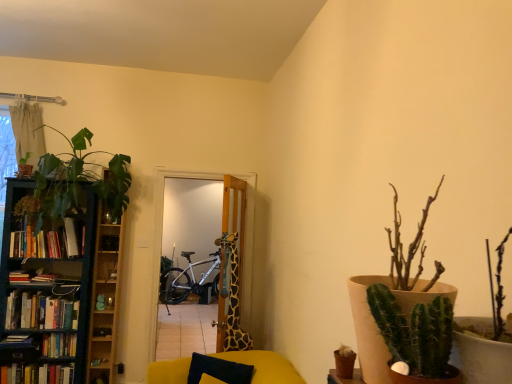
The height and width of the screenshot is (384, 512). Find the location of `green leafy plant at upper left, the third houseplant when ordered from right to left`. green leafy plant at upper left, the third houseplant when ordered from right to left is located at coordinates (24, 167).

What is the approximate height of beige fabric curtain at upper left?

Answer: beige fabric curtain at upper left is 25.78 inches in height.

In order to click on hardcover books at left, which ranks as the 5th book in top-to-bottom order in this screenshot , I will do `click(36, 374)`.

This screenshot has height=384, width=512. I want to click on teal wooden bookcase at left, so click(x=46, y=292).

Is hardcover books at left, marked as the 1th book in a top-to-bottom arrangement, turned away from green leafy plant at left, which ranks as the 2th houseplant in left-to-right order?

That's right, hardcover books at left, marked as the 1th book in a top-to-bottom arrangement, is facing away from green leafy plant at left, which ranks as the 2th houseplant in left-to-right order.

Looking at their sizes, would you say hardcover books at left, arranged as the fifth book when ordered from the bottom, is wider or thinner than green leafy plant at left, the 2th houseplant viewed from the right?

hardcover books at left, arranged as the fifth book when ordered from the bottom, is thinner than green leafy plant at left, the 2th houseplant viewed from the right.

Between point (65, 220) and point (44, 161), which one is positioned in front?

The point (44, 161) is closer.

Is hardcover books at left, arranged as the fifth book when ordered from the bottom, taller or shorter than green leafy plant at left, which ranks as the 2th houseplant in left-to-right order?

In the image, hardcover books at left, arranged as the fifth book when ordered from the bottom, appears to be shorter than green leafy plant at left, which ranks as the 2th houseplant in left-to-right order.

Based on the photo, how many degrees apart are the facing directions of hardcover books at left, marked as the 1th book in a top-to-bottom arrangement, and giraffe-patterned wood screen door at center?

111 degrees separate the facing orientations of hardcover books at left, marked as the 1th book in a top-to-bottom arrangement, and giraffe-patterned wood screen door at center.

Is hardcover books at left, arranged as the fifth book when ordered from the bottom, thinner than giraffe-patterned wood screen door at center?

No, hardcover books at left, arranged as the fifth book when ordered from the bottom, is not thinner than giraffe-patterned wood screen door at center.

In the scene shown: Considering the relative sizes of hardcover books at left, marked as the 1th book in a top-to-bottom arrangement, and giraffe-patterned wood screen door at center in the image provided, is hardcover books at left, marked as the 1th book in a top-to-bottom arrangement, shorter than giraffe-patterned wood screen door at center?

Yes, hardcover books at left, marked as the 1th book in a top-to-bottom arrangement, is shorter than giraffe-patterned wood screen door at center.

Can you confirm if hardcover book at left, marked as the fourth book in a top-to-bottom arrangement, is bigger than beige fabric curtain at upper left?

No, hardcover book at left, marked as the fourth book in a top-to-bottom arrangement, is not bigger than beige fabric curtain at upper left.

Is hardcover book at left, marked as the fourth book in a top-to-bottom arrangement, turned away from beige fabric curtain at upper left?

No, hardcover book at left, marked as the fourth book in a top-to-bottom arrangement, is not facing the opposite direction of beige fabric curtain at upper left.

In terms of width, does hardcover book at left, marked as the fourth book in a top-to-bottom arrangement, look wider or thinner when compared to beige fabric curtain at upper left?

hardcover book at left, marked as the fourth book in a top-to-bottom arrangement, is wider than beige fabric curtain at upper left.

Consider the image. Is hardcover book at left, marked as the fourth book in a top-to-bottom arrangement, taller or shorter than beige fabric curtain at upper left?

hardcover book at left, marked as the fourth book in a top-to-bottom arrangement, is shorter than beige fabric curtain at upper left.

You are a GUI agent. You are given a task and a screenshot of the screen. Output one action in this format:
    pyautogui.click(x=<x>, y=<y>)
    Task: Click on the screen door that is in front of the hardcover book at left, positioned as the second book in bottom-to-top order
    The height and width of the screenshot is (384, 512).
    Given the screenshot: What is the action you would take?
    pyautogui.click(x=163, y=207)

Is the surface of hardcover book at left, positioned as the second book in bottom-to-top order, in direct contact with giraffe-patterned wood screen door at center?

No, hardcover book at left, positioned as the second book in bottom-to-top order, is not in contact with giraffe-patterned wood screen door at center.

Can you confirm if hardcover book at left, marked as the fourth book in a top-to-bottom arrangement, is thinner than giraffe-patterned wood screen door at center?

No.

Considering the sizes of objects teal wooden bookcase at left and beige ceramic pot at right in the image provided, who is smaller, teal wooden bookcase at left or beige ceramic pot at right?

With smaller size is beige ceramic pot at right.

Based on the photo, can we say teal wooden bookcase at left lies outside beige ceramic pot at right?

Yes, teal wooden bookcase at left is outside of beige ceramic pot at right.

From a real-world perspective, is teal wooden bookcase at left on top of beige ceramic pot at right?

Actually, teal wooden bookcase at left is physically below beige ceramic pot at right in the real world.

Is teal wooden bookcase at left oriented away from beige ceramic pot at right?

No, teal wooden bookcase at left is not facing away from beige ceramic pot at right.

Is hardcover book at left, positioned as the second book in bottom-to-top order, not within beige ceramic pot at right?

That's correct, hardcover book at left, positioned as the second book in bottom-to-top order, is outside of beige ceramic pot at right.

Relative to beige ceramic pot at right, is hardcover book at left, marked as the fourth book in a top-to-bottom arrangement, in front or behind?

Visually, hardcover book at left, marked as the fourth book in a top-to-bottom arrangement, is located behind beige ceramic pot at right.

From the image's perspective, which object appears higher, hardcover book at left, positioned as the second book in bottom-to-top order, or beige ceramic pot at right?

beige ceramic pot at right, from the image's perspective.

How many degrees apart are the facing directions of hardcover book at left, positioned as the second book in bottom-to-top order, and beige ceramic pot at right?

91.6 degrees.

Does green leafy plant at upper left, the 3th houseplant viewed from the front, have a lesser width compared to silver metallic bicycle at center?

Indeed, green leafy plant at upper left, the 3th houseplant viewed from the front, has a lesser width compared to silver metallic bicycle at center.

Between green leafy plant at upper left, the 1th houseplant viewed from the back, and silver metallic bicycle at center, which one has less height?

green leafy plant at upper left, the 1th houseplant viewed from the back.

Identify the location of the 3rd houseplant above the silver metallic bicycle at center (from a real-world perspective). (24, 167).

Does point (24, 168) come behind point (161, 294)?

That is False.

This screenshot has width=512, height=384. In order to click on the 3rd book behind the green leafy plant at left, the 2th houseplant from the front in this screenshot , I will do `click(47, 242)`.

At what (x,y) coordinates should I click in order to perform the action: click on book above the giraffe-patterned wood screen door at center (from a real-world perspective). Please return your answer as a coordinate pair (x, y). The height and width of the screenshot is (384, 512). Looking at the image, I should click on click(47, 242).

Based on their spatial positions, is hardcover books at left, the 4th book positioned from the bottom, or velvety dark blue pillow at lower center closer to silver metallic bicycle at center?

Based on the image, hardcover books at left, the 4th book positioned from the bottom, appears to be nearer to silver metallic bicycle at center.

Looking at the image, which one is located closer to green matte cactus at right, giraffe-patterned door at center or hardcover books at left, the 4th book positioned from the bottom?

Based on the image, giraffe-patterned door at center appears to be nearer to green matte cactus at right.

Which object lies nearer to the anchor point hardcover books at left, the 4th book positioned from the bottom, silver metallic bicycle at center or beige ceramic pot at right?

silver metallic bicycle at center is closer to hardcover books at left, the 4th book positioned from the bottom.

When comparing their distances from hardcover books at left, marked as the 1th book in a top-to-bottom arrangement, does green matte cactus at right or hardcover book at left, the 3th book when ordered from bottom to top, seem closer?

Based on the image, hardcover book at left, the 3th book when ordered from bottom to top, appears to be nearer to hardcover books at left, marked as the 1th book in a top-to-bottom arrangement.

Considering their positions, is green leafy plant at upper left, positioned as the 1th houseplant in left-to-right order, positioned further to hardcover books at left, marked as the first book in a bottom-to-top arrangement, than silver metallic bicycle at center?

silver metallic bicycle at center.

Consider the image. Based on their spatial positions, is giraffe-patterned wood screen door at center or hardcover book at left, positioned as the second book in bottom-to-top order, further from green matte cactus at right?

Based on the image, hardcover book at left, positioned as the second book in bottom-to-top order, appears to be further to green matte cactus at right.

Based on their spatial positions, is silver metallic bicycle at center or velvety dark blue pillow at lower center further from green spiky cactus at right, which appears as the 1th houseplant when viewed from the front?

The object further to green spiky cactus at right, which appears as the 1th houseplant when viewed from the front, is silver metallic bicycle at center.

Estimate the real-world distances between objects in this image. Which object is closer to hardcover books at left, which ranks as the 5th book in top-to-bottom order, silver metallic bicycle at center or hardcover books at left, the 4th book positioned from the bottom?

hardcover books at left, the 4th book positioned from the bottom, lies closer to hardcover books at left, which ranks as the 5th book in top-to-bottom order, than the other object.

Find the location of a particular element. The image size is (512, 384). bookcase between green spiky cactus at right, the 1th houseplant when ordered from right to left, and hardcover book at left, which appears as the 3th book when viewed from the top, along the z-axis is located at coordinates (46, 292).

Locate an element on the screen. Image resolution: width=512 pixels, height=384 pixels. cabinet between hardcover books at left, the second book in the top-to-bottom sequence, and velvety dark blue pillow at lower center is located at coordinates (104, 298).

Identify the location of screen door between beige ceramic pot at right and green leafy plant at upper left, the 1th houseplant viewed from the back, along the z-axis. The height and width of the screenshot is (384, 512). (163, 207).

Locate an element on the screen. This screenshot has width=512, height=384. pillow situated between hardcover book at left, marked as the fourth book in a top-to-bottom arrangement, and giraffe-patterned wood screen door at center from left to right is located at coordinates (219, 370).